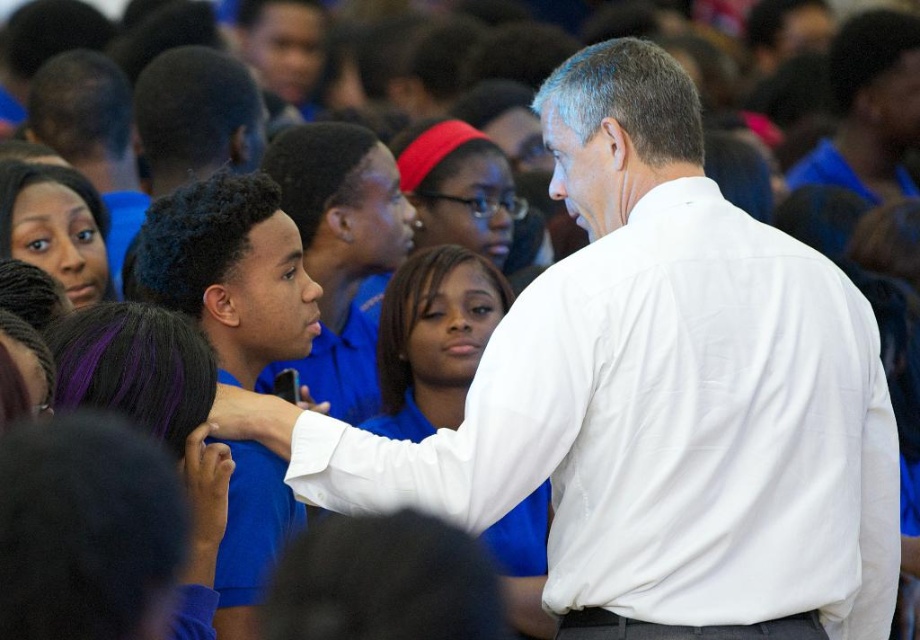
Can you confirm if white smooth shirt at center is bigger than blue shirt at center?

Correct, white smooth shirt at center is larger in size than blue shirt at center.

Who is more distant from viewer, (871, 547) or (207, 337)?

The point (871, 547) is behind.

The width and height of the screenshot is (920, 640). What are the coordinates of `white smooth shirt at center` in the screenshot? It's located at (653, 397).